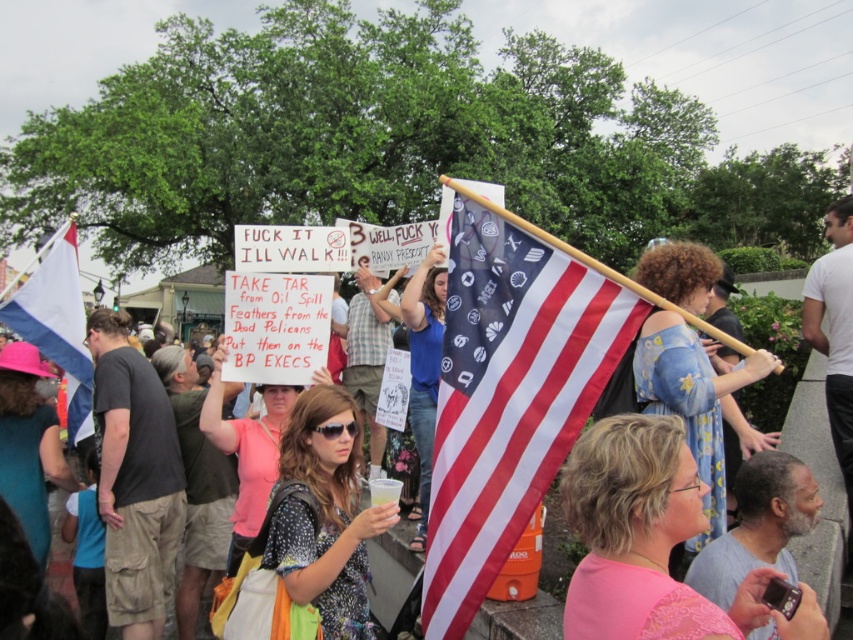
Is point (38, 506) positioned before point (212, 422)?

That is False.

Between pink fabric hat at upper left and pink fabric shirt at center, which one has less height?

pink fabric hat at upper left is shorter.

Where is `pink fabric hat at upper left`? pink fabric hat at upper left is located at coordinates (28, 444).

The height and width of the screenshot is (640, 853). Find the location of `pink fabric hat at upper left`. pink fabric hat at upper left is located at coordinates (28, 444).

Does point (682, 506) lie in front of point (28, 541)?

Yes, point (682, 506) is closer to viewer.

Identify the location of pink lace dress at center. (653, 541).

Does point (670, 436) come closer to viewer compared to point (6, 413)?

Yes, point (670, 436) is closer to viewer.

Locate an element on the screen. This screenshot has height=640, width=853. pink lace dress at center is located at coordinates (653, 541).

Between polka dot fabric dress at center and white fabric flag at left, which one has more height?

white fabric flag at left

Does polka dot fabric dress at center have a smaller size compared to white fabric flag at left?

Yes.

You are a GUI agent. You are given a task and a screenshot of the screen. Output one action in this format:
    pyautogui.click(x=<x>, y=<y>)
    Task: Click on the polka dot fabric dress at center
    This screenshot has height=640, width=853.
    Given the screenshot: What is the action you would take?
    pyautogui.click(x=323, y=515)